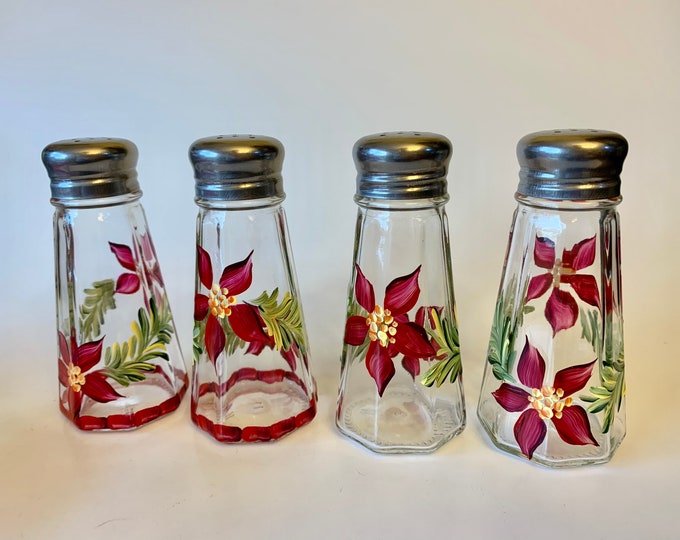
This screenshot has height=540, width=680. What are the coordinates of `glass` in the screenshot? It's located at (398, 238).